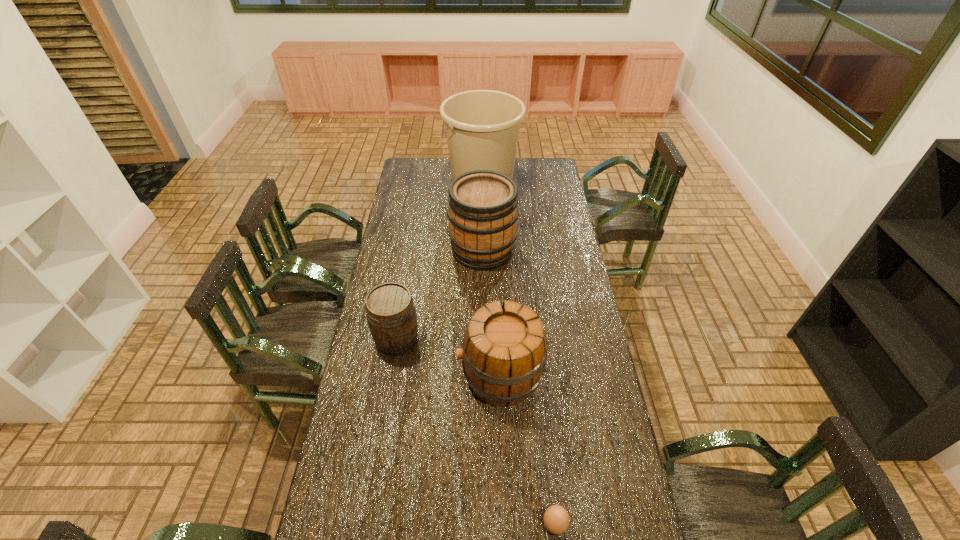
Identify the location of object identified as the closest to the farthest cider. The image size is (960, 540). (482, 127).

Identify which cider is located as the third nearest to the tallest object. Please provide its 2D coordinates. Your answer should be formatted as a tuple, i.e. [(x, y)], where the tuple contains the x and y coordinates of a point satisfying the conditions above.

[(504, 349)]

In order to click on cider that stands as the third closest to the farthest object in this screenshot , I will do `click(504, 349)`.

Image resolution: width=960 pixels, height=540 pixels. I want to click on vacant space that satisfies the following two spatial constraints: 1. on the front side of the farthest object; 2. on the left side of the nearest object, so click(485, 524).